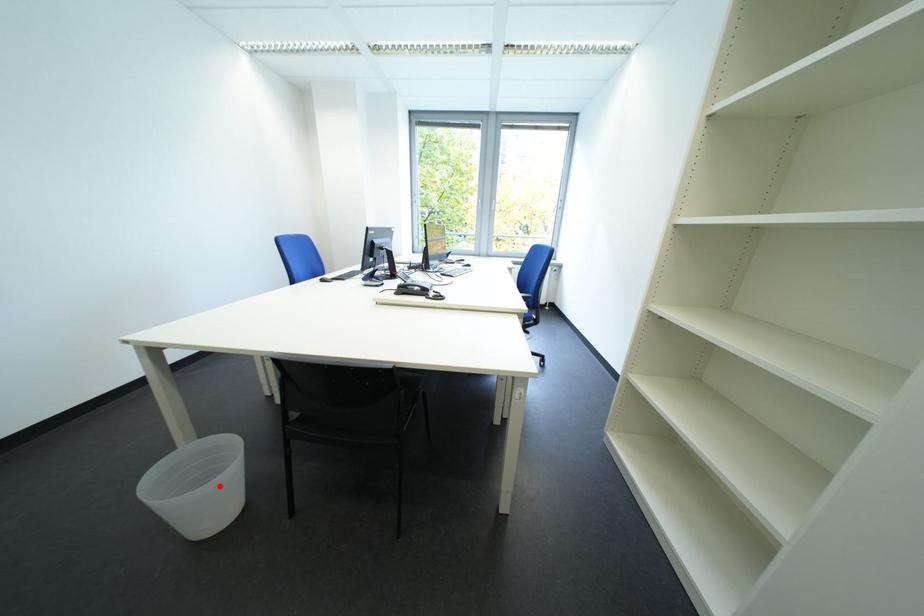
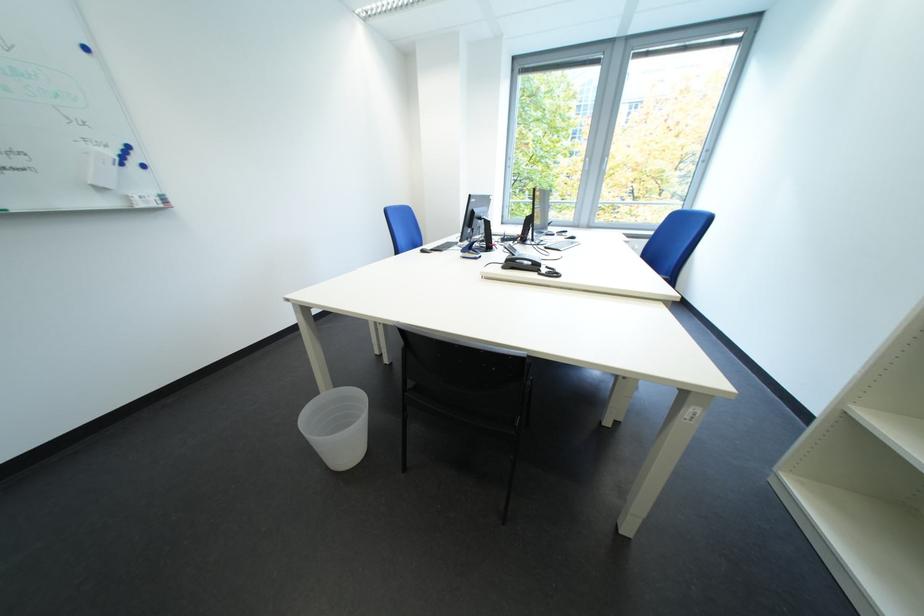
Question: I am providing you with two images of the same scene from different viewpoints. A red point is shown in image1. For the corresponding object point in image2, is it positioned nearer or farther from the camera?

Choices:
 (A) Nearer
 (B) Farther

Answer: (B)